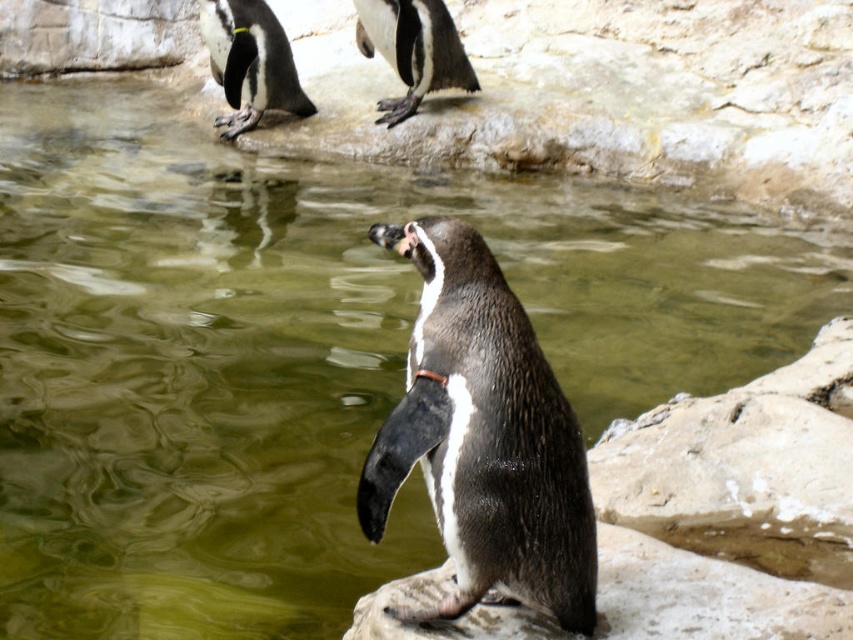
You are observing two penguins in a zoo enclosure. You see the black glossy penguin at center and the black glossy penguin at upper center. Which of these penguins is the smaller one?

The black glossy penguin at center is smaller in size compared to the black glossy penguin at upper center.

You are a photographer standing in front of the black glossy penguin at center. Your camera has a focal length of 50mm and you want to take a photo that fills the frame with the penguin. Given that the recommended distance for this setup is 2.5 meters, can you proceed without moving closer or farther?

The black glossy penguin at center and camera are 2.45 meters apart. Since the recommended distance is 2.5 meters, you are slightly too close. To achieve the desired framing, you should move back approximately 0.05 meters.

You are a zookeeper standing at the edge of the penguin enclosure. You need to feed the black glossy penguin at center. The feeding tool you have can reach up to 2 meters. Can you reach the penguin with your tool?

The black glossy penguin at center and the viewer are 2.45 meters apart. Since the feeding tool can only reach up to 2 meters, you cannot reach the penguin with your current tool.